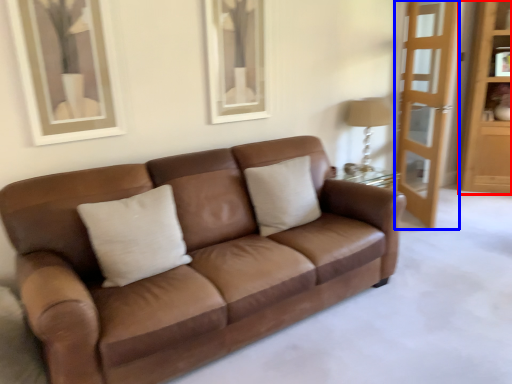
Question: Which of the following is the closest to the observer, dresser (highlighted by a red box) or screen door (highlighted by a blue box)?

Choices:
 (A) dresser
 (B) screen door

Answer: (B)